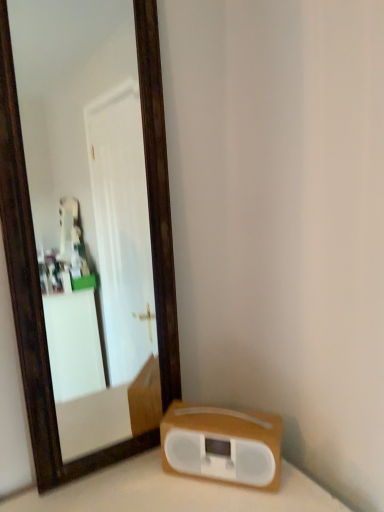
Where is `free point above white plastic stereo at lower right (from a real-world perspective)`? free point above white plastic stereo at lower right (from a real-world perspective) is located at coordinates (218, 414).